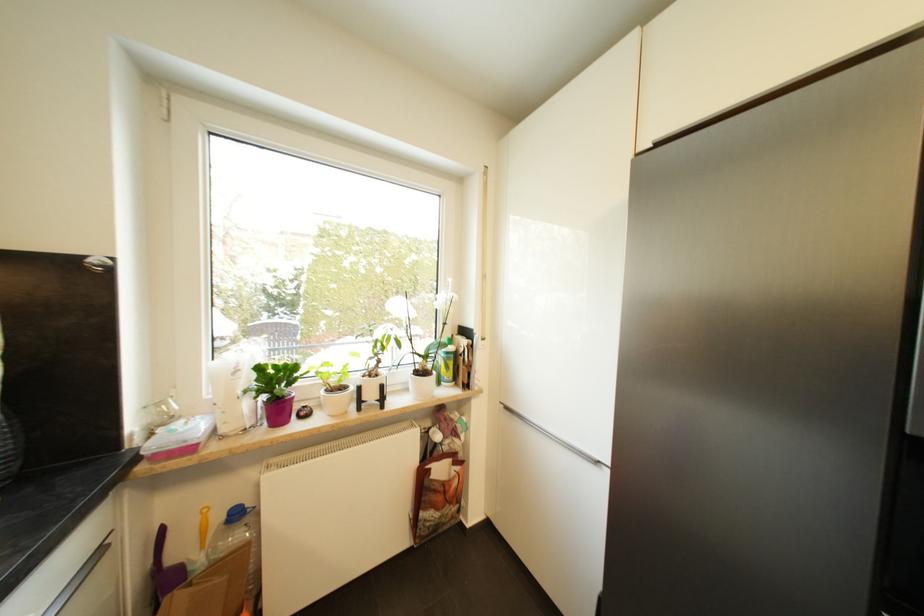
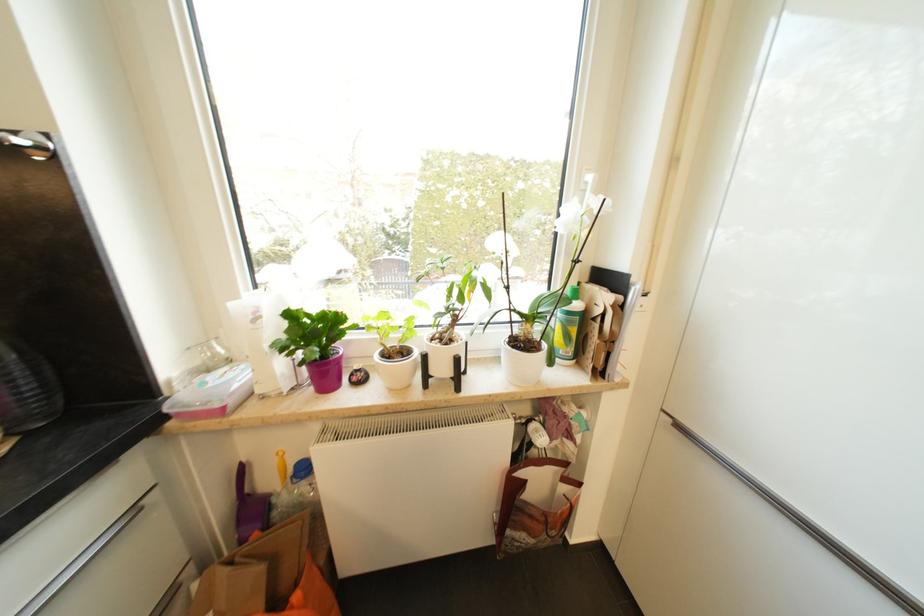
Locate, in the second image, the point that corresponds to the point at 453,355 in the first image.

(574, 315)